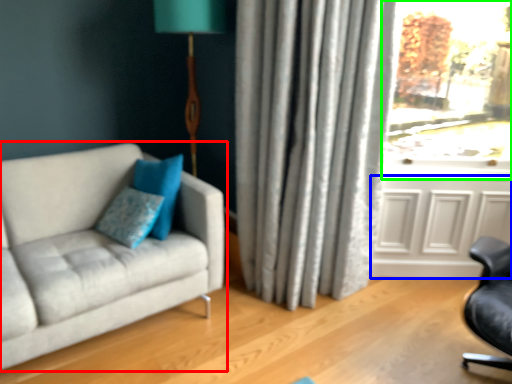
Question: Considering the real-world distances, which object is closest to studio couch (highlighted by a red box)? screen door (highlighted by a blue box) or window (highlighted by a green box).

Choices:
 (A) screen door
 (B) window

Answer: (A)